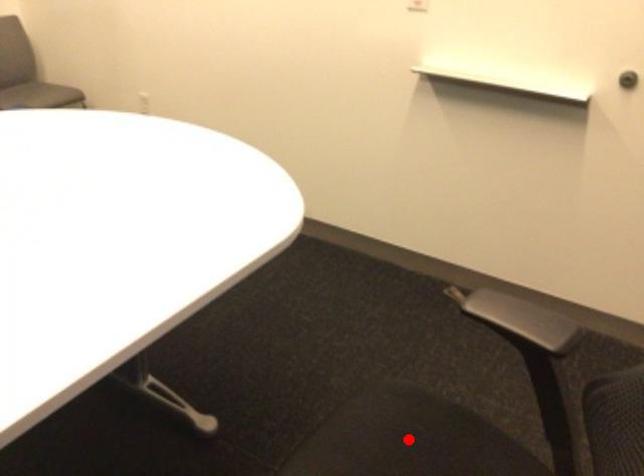
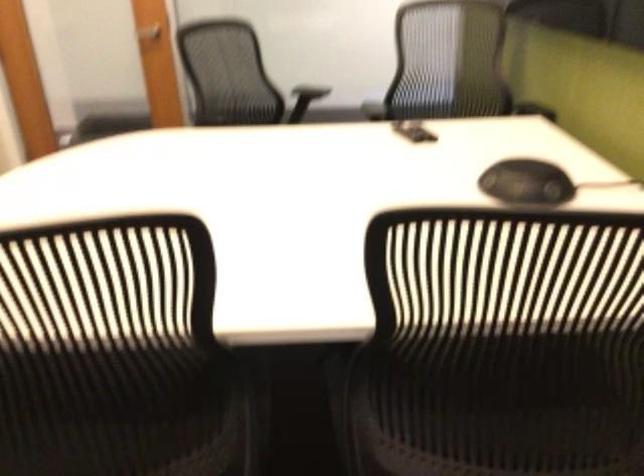
Question: I am providing you with two images of the same scene from different viewpoints. A red point is marked on the first image. Can you still see the location of the red point in image 2?

Choices:
 (A) Yes
 (B) No

Answer: (B)